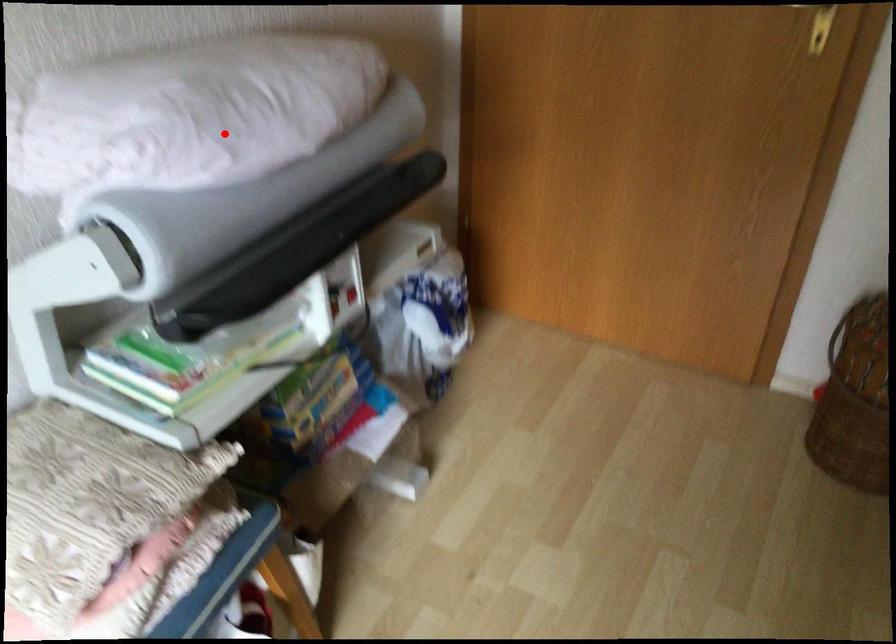
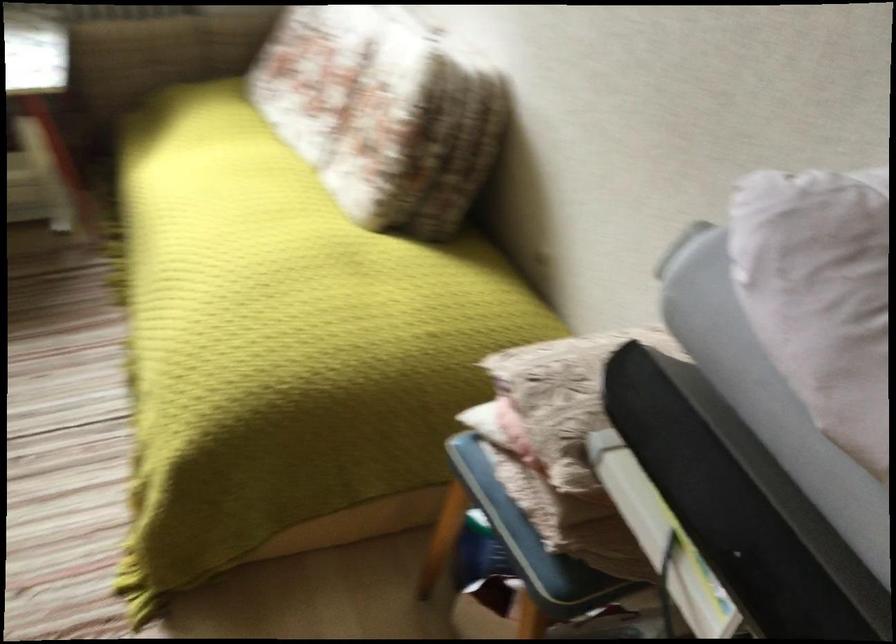
Question: A red point is marked in image1. In image2, is the corresponding 3D point closer to the camera or farther? Reply with the corresponding letter.

Choices:
 (A) The corresponding 3D point is closer.
 (B) The corresponding 3D point is farther.

Answer: (A)